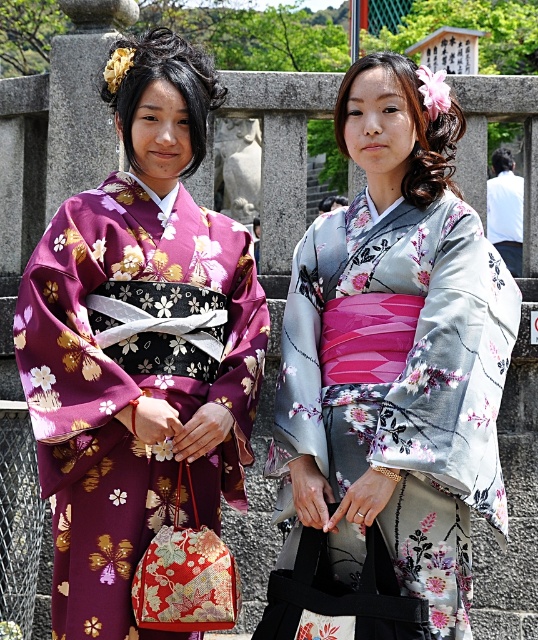
You are a photographer planning to take a portrait of the two individuals wearing the matte floral kimono at center and the silky floral kimono at center. Since you want to ensure both subjects are framed properly, which kimono is taller so you can adjust the camera angle accordingly?

The matte floral kimono at center is much taller than the silky floral kimono at center, so you should adjust the camera angle to account for its height difference.